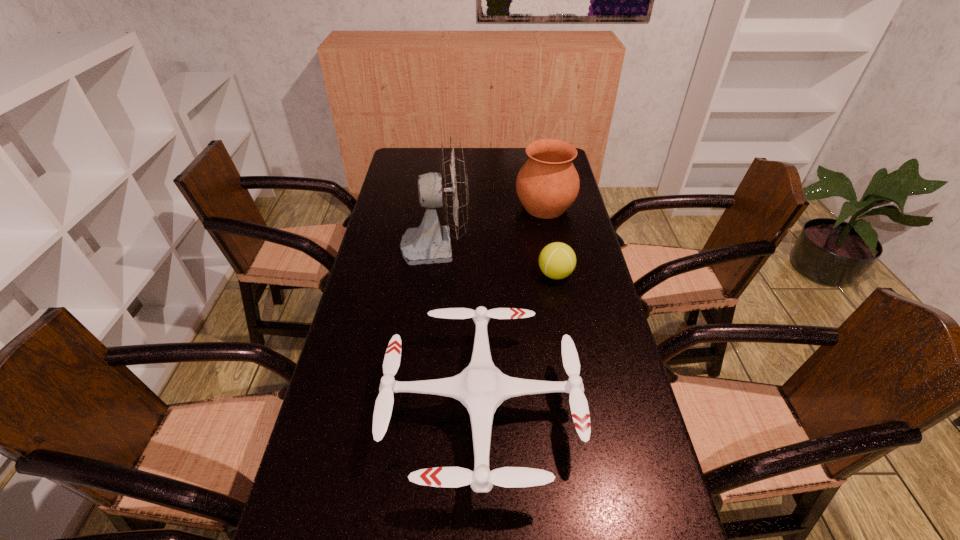
Find the location of `fan situated at the left edge`. fan situated at the left edge is located at coordinates (430, 243).

Identify the location of drone that is positioned at the left edge. (481, 387).

Identify the location of pottery at the right edge. (547, 184).

Locate an element on the screen. This screenshot has height=540, width=960. drone positioned at the right edge is located at coordinates (481, 387).

Find the location of `tennis ball that is at the right edge`. tennis ball that is at the right edge is located at coordinates (557, 260).

I want to click on vacant area at the far edge of the desktop, so (515, 159).

Image resolution: width=960 pixels, height=540 pixels. In the image, there is a desktop. In order to click on free region at the left edge in this screenshot , I will do `click(421, 211)`.

Where is `vacant space at the right edge of the desktop`? This screenshot has height=540, width=960. vacant space at the right edge of the desktop is located at coordinates (570, 285).

At what (x,y) coordinates should I click in order to perform the action: click on free space that is in between the nearest object and the tallest object. Please return your answer as a coordinate pair (x, y). Image resolution: width=960 pixels, height=540 pixels. Looking at the image, I should click on [459, 326].

You are a GUI agent. You are given a task and a screenshot of the screen. Output one action in this format:
    pyautogui.click(x=<x>, y=<y>)
    Task: Click on the empty space between the third shortest object and the nearest object
    
    Given the screenshot: What is the action you would take?
    pyautogui.click(x=514, y=307)